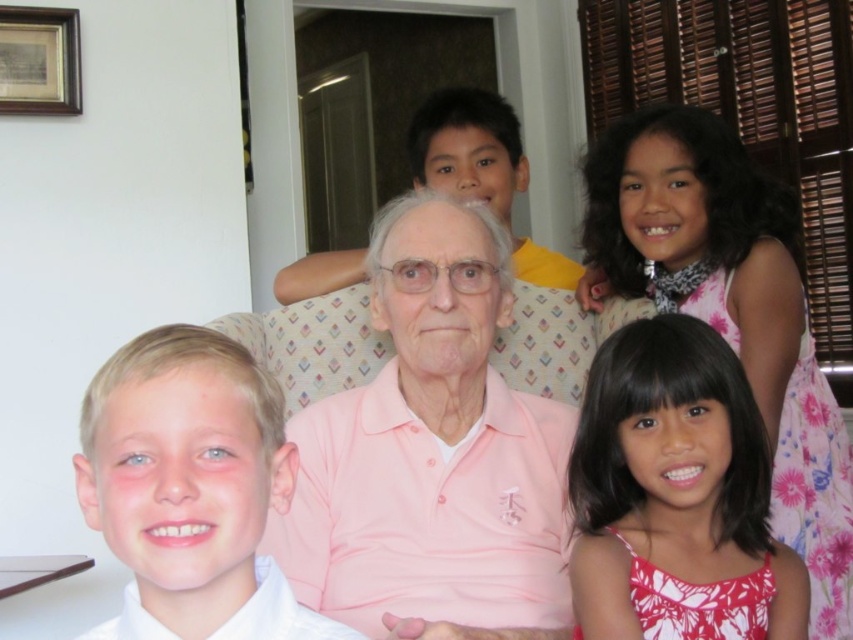
Can you confirm if pink floral dress at lower right is thinner than blonde hair boy at left?

In fact, pink floral dress at lower right might be wider than blonde hair boy at left.

Does point (688, 529) lie in front of point (283, 625)?

No, it is not.

Identify the location of pink floral dress at lower right. This screenshot has height=640, width=853. (676, 493).

Between point (676, 381) and point (36, 33), which one is positioned behind?

Point (36, 33)

Who is positioned more to the right, pink floral dress at lower right or wooden picture frame at upper left?

From the viewer's perspective, pink floral dress at lower right appears more on the right side.

At what (x,y) coordinates should I click in order to perform the action: click on pink floral dress at lower right. Please return your answer as a coordinate pair (x, y). This screenshot has height=640, width=853. Looking at the image, I should click on (676, 493).

Between pink cotton shirt at center and pink floral dress at lower right, which one appears on the left side from the viewer's perspective?

Positioned to the left is pink cotton shirt at center.

Does pink cotton shirt at center appear on the right side of pink floral dress at lower right?

Incorrect, pink cotton shirt at center is not on the right side of pink floral dress at lower right.

The image size is (853, 640). I want to click on pink cotton shirt at center, so click(432, 456).